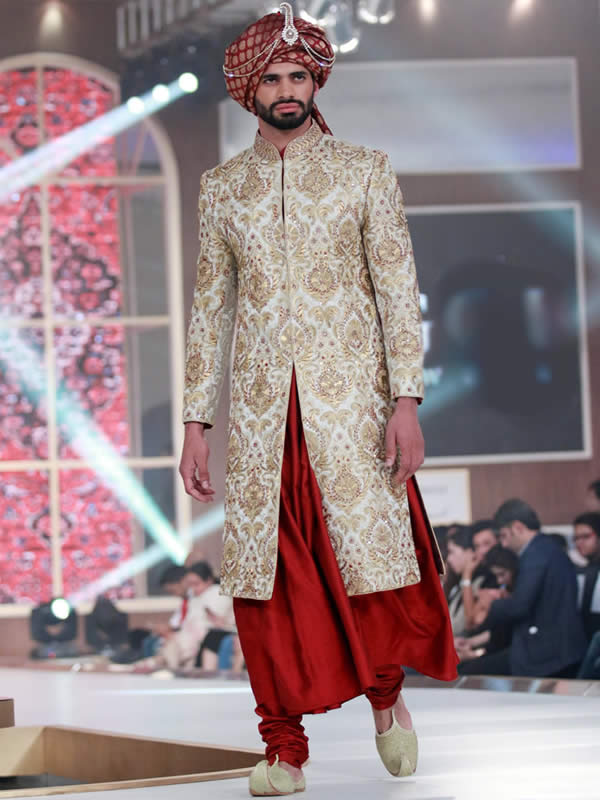
The image size is (600, 800). Find the location of `spotlight beams`. spotlight beams is located at coordinates coord(97,114), coord(95,462), coord(140,562).